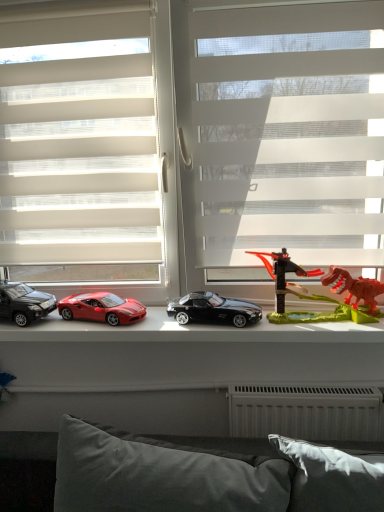
The image size is (384, 512). What are the coordinates of `free space above shiny plastic toy cars at center (from a real-world perspective)` in the screenshot? It's located at (182, 318).